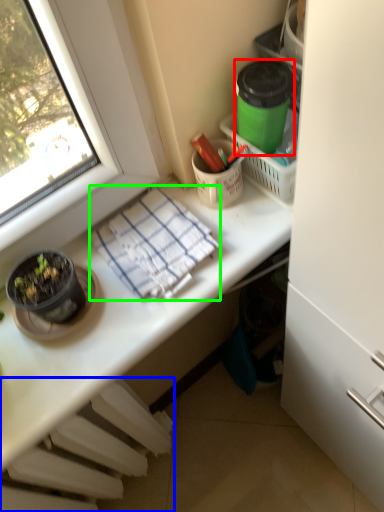
Question: Which is nearer to the appliance (highlighted by a red box)? radiator (highlighted by a blue box) or blanket (highlighted by a green box).

Choices:
 (A) radiator
 (B) blanket

Answer: (B)